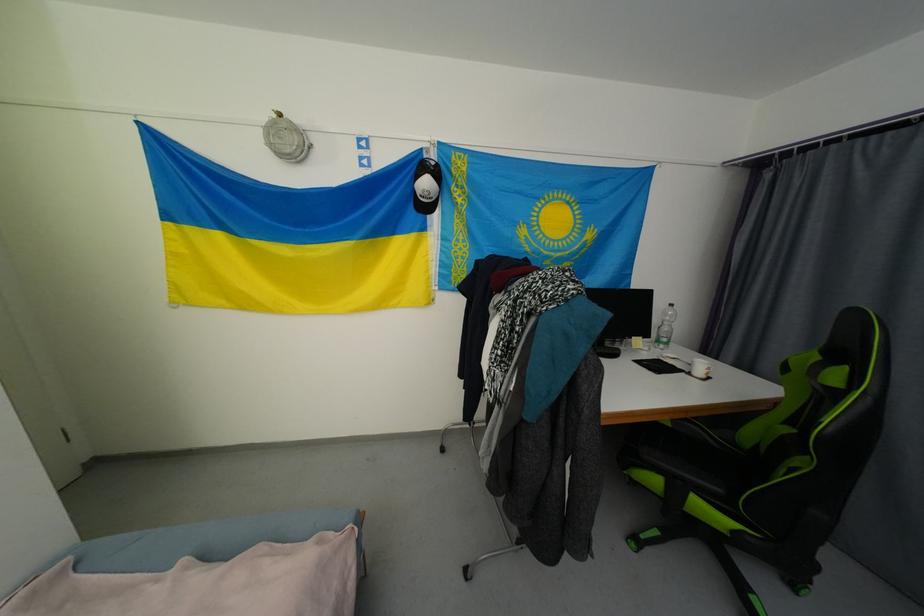
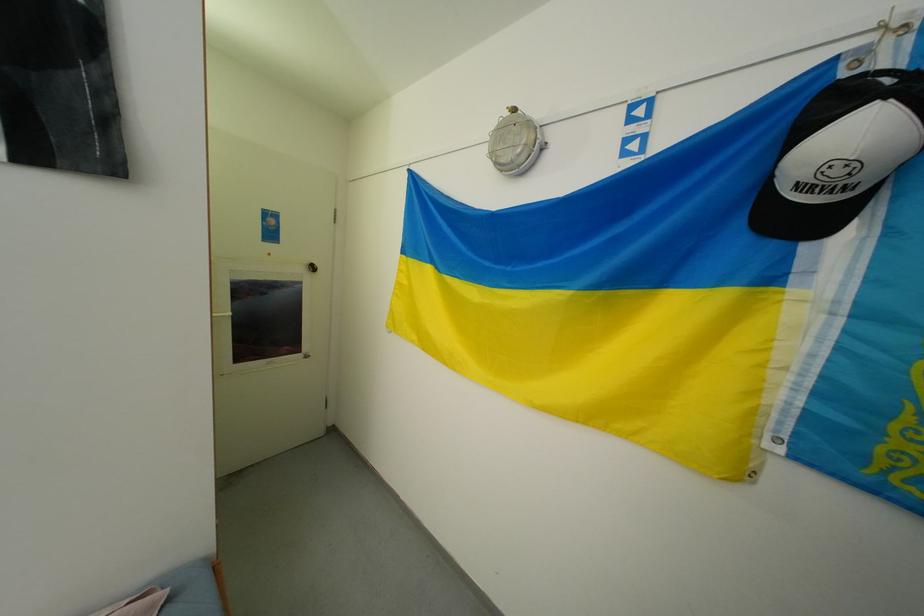
Find the pixel in the second image that matches point (439, 164) in the first image.

(896, 81)